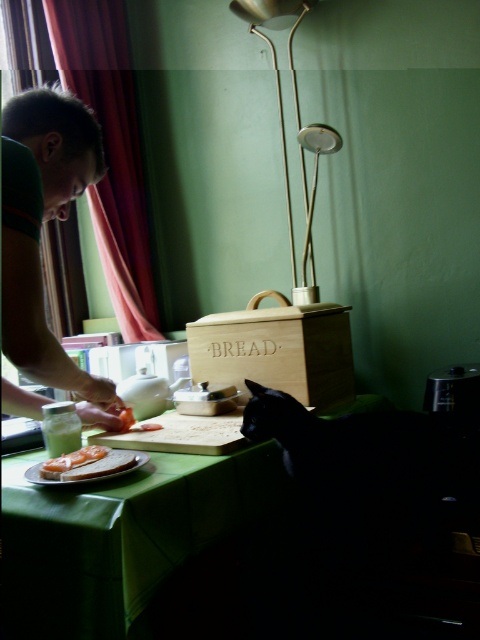
You are standing at point (2, 186) and want to move to point (254, 460). Is the path directly in front of you clear? Explain using the scene details.

The path directly in front of you to point (254, 460) is not clear because point (254, 460) is behind point (2, 186), meaning there might be obstacles blocking your view or path.

You are a chef looking to set up a workspace in this kitchen. You want to place a new cutting board on the green fabric table at lower center. However, you need to ensure that the gold metallic lamp at upper center won not cast a shadow over your work area. Can you confirm if the lamp is positioned in a way that would cause this issue?

The green fabric table at lower center is positioned under the gold metallic lamp at upper center, so the lamp is directly above the table. This means the gold metallic lamp at upper center will cast a shadow over the green fabric table at lower center, potentially causing shadow issues during work.

You are standing in the kitchen and want to place a new spice jar on the green fabric table at lower center. The coordinates provided are in a normalized system where the bottom left corner is the origin. Is the point at coordinates point (x=120, y=536) on the green fabric table at lower center a suitable location for the spice jar?

The point at coordinates point (x=120, y=536) on the green fabric table at lower center is the exact location of the green fabric table at lower center, so yes, placing the spice jar there would be suitable.